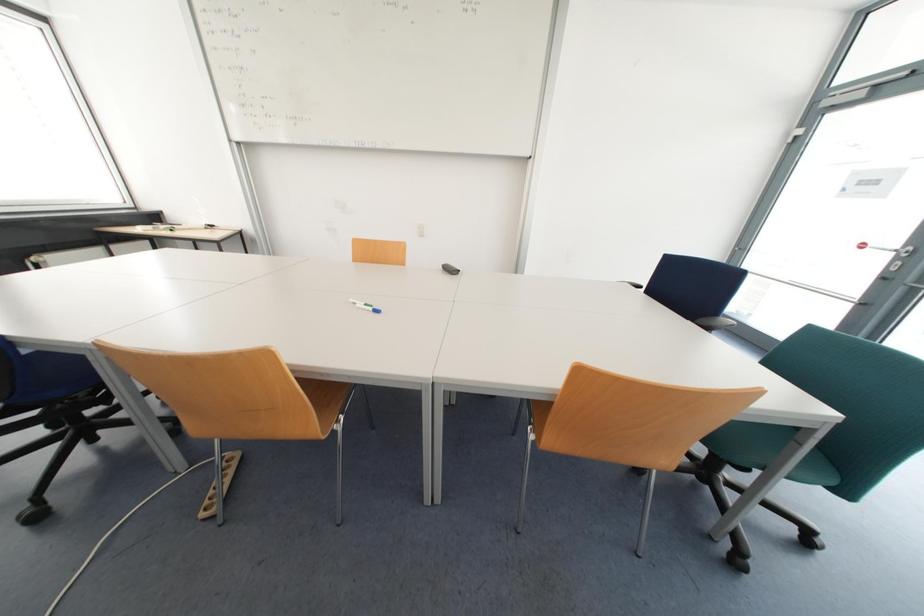
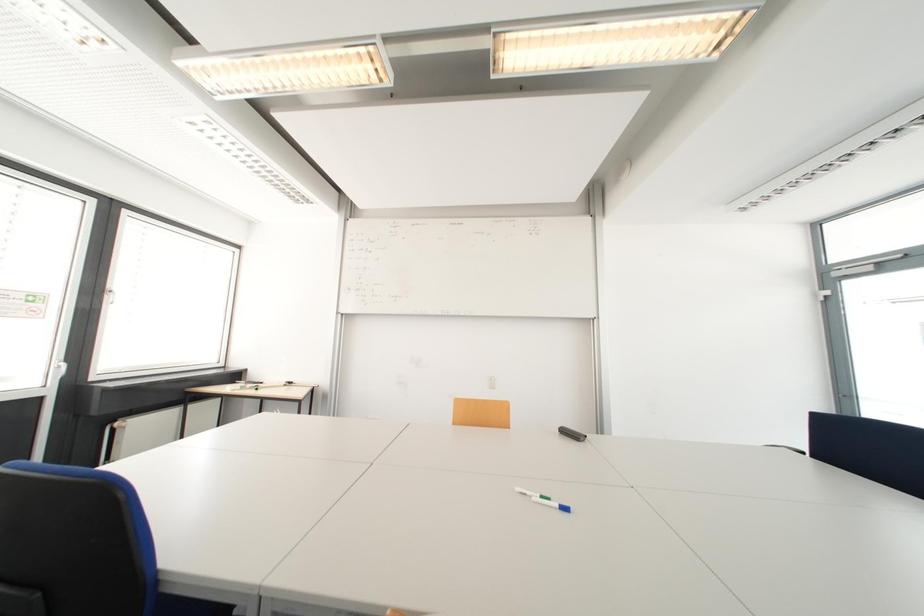
Question: The first image is from the beginning of the video and the second image is from the end. How did the camera likely rotate when shooting the video?

Choices:
 (A) Left
 (B) Right
 (C) Up
 (D) Down

Answer: (C)